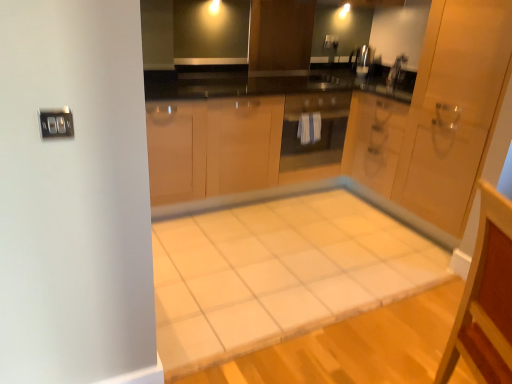
Question: Is satin nickel faucet at upper center a part of matte glass oven at center?

Choices:
 (A) no
 (B) yes

Answer: (A)

Question: From the image's perspective, is matte glass oven at center over satin nickel faucet at upper center?

Choices:
 (A) no
 (B) yes

Answer: (A)

Question: Is the position of matte glass oven at center less distant than that of satin nickel faucet at upper center?

Choices:
 (A) no
 (B) yes

Answer: (B)

Question: Is matte glass oven at center wider than satin nickel faucet at upper center?

Choices:
 (A) yes
 (B) no

Answer: (A)

Question: Does matte glass oven at center lie behind satin nickel faucet at upper center?

Choices:
 (A) yes
 (B) no

Answer: (B)

Question: Is matte glass oven at center located outside satin nickel faucet at upper center?

Choices:
 (A) no
 (B) yes

Answer: (B)

Question: Does satin nickel faucet at upper center have a larger size compared to matte glass oven at center?

Choices:
 (A) yes
 (B) no

Answer: (B)

Question: Does satin nickel faucet at upper center have a greater width compared to matte glass oven at center?

Choices:
 (A) no
 (B) yes

Answer: (A)

Question: Is the position of satin nickel faucet at upper center less distant than that of matte glass oven at center?

Choices:
 (A) yes
 (B) no

Answer: (B)

Question: Considering the relative sizes of satin nickel faucet at upper center and matte glass oven at center in the image provided, is satin nickel faucet at upper center thinner than matte glass oven at center?

Choices:
 (A) yes
 (B) no

Answer: (A)

Question: From a real-world perspective, is satin nickel faucet at upper center positioned under matte glass oven at center based on gravity?

Choices:
 (A) yes
 (B) no

Answer: (B)

Question: Is satin nickel faucet at upper center not within matte glass oven at center?

Choices:
 (A) yes
 (B) no

Answer: (A)

Question: Is white tile vanity at lower right closer to camera compared to white tile table at center?

Choices:
 (A) no
 (B) yes

Answer: (B)